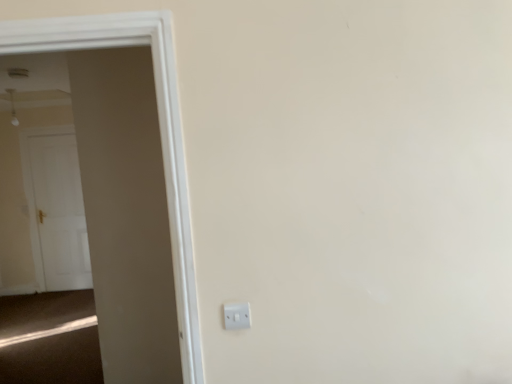
Question: Can you confirm if white wooden door at left, which appears as the 1th door when viewed from the front, is smaller than white plastic electric outlet at lower center?

Choices:
 (A) no
 (B) yes

Answer: (A)

Question: Is the position of white wooden door at left, which appears as the first door when viewed from the right, more distant than that of white plastic electric outlet at lower center?

Choices:
 (A) no
 (B) yes

Answer: (A)

Question: Can we say white wooden door at left, which is the 2th door in back-to-front order, lies outside white plastic electric outlet at lower center?

Choices:
 (A) yes
 (B) no

Answer: (A)

Question: Does white wooden door at left, which appears as the 1th door when viewed from the front, contain white plastic electric outlet at lower center?

Choices:
 (A) yes
 (B) no

Answer: (B)

Question: Is white wooden door at left, which appears as the 1th door when viewed from the front, at the left side of white plastic electric outlet at lower center?

Choices:
 (A) no
 (B) yes

Answer: (B)

Question: Does point (154, 19) appear closer or farther from the camera than point (28, 145)?

Choices:
 (A) closer
 (B) farther

Answer: (A)

Question: From the image's perspective, is white wooden door at left, which is the 2th door in back-to-front order, positioned above or below white glossy door at left, which is the 1th door in back-to-front order?

Choices:
 (A) above
 (B) below

Answer: (A)

Question: Relative to white glossy door at left, which is the 1th door in back-to-front order, is white wooden door at left, which appears as the first door when viewed from the right, in front or behind?

Choices:
 (A) behind
 (B) front

Answer: (B)

Question: Is white wooden door at left, which appears as the 1th door when viewed from the front, taller or shorter than white glossy door at left, the second door when ordered from right to left?

Choices:
 (A) short
 (B) tall

Answer: (A)

Question: From the image's perspective, relative to white plastic electric outlet at lower center, is white glossy door at left, placed as the first door when sorted from left to right, above or below?

Choices:
 (A) below
 (B) above

Answer: (B)

Question: From a real-world perspective, is white glossy door at left, the second door positioned from the front, positioned above or below white plastic electric outlet at lower center?

Choices:
 (A) above
 (B) below

Answer: (B)

Question: Based on their sizes in the image, would you say white glossy door at left, placed as the first door when sorted from left to right, is bigger or smaller than white plastic electric outlet at lower center?

Choices:
 (A) small
 (B) big

Answer: (B)

Question: In the image, is white glossy door at left, which is the 1th door in back-to-front order, on the left side or the right side of white plastic electric outlet at lower center?

Choices:
 (A) right
 (B) left

Answer: (B)

Question: Is white wooden door at left, which appears as the first door when viewed from the right, in front of or behind white plastic electric outlet at lower center in the image?

Choices:
 (A) front
 (B) behind

Answer: (A)

Question: Do you think white wooden door at left, which appears as the 1th door when viewed from the front, is within white plastic electric outlet at lower center, or outside of it?

Choices:
 (A) inside
 (B) outside

Answer: (B)